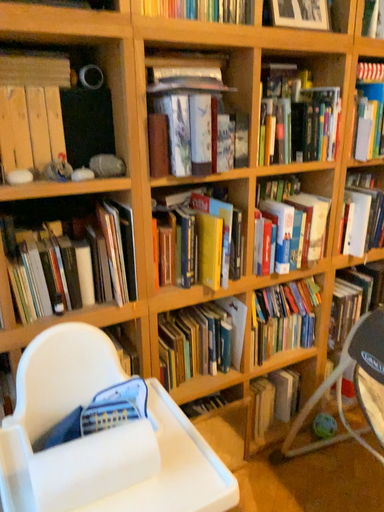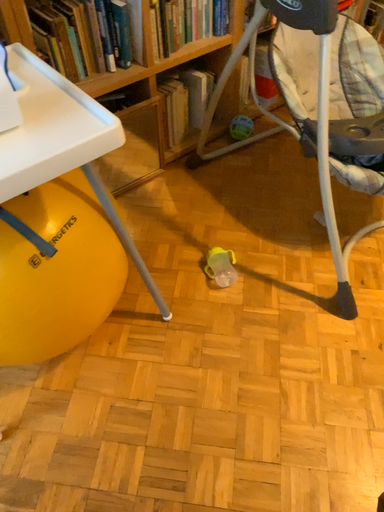
Question: How did the camera likely rotate when shooting the video?

Choices:
 (A) rotated downward
 (B) rotated upward

Answer: (A)